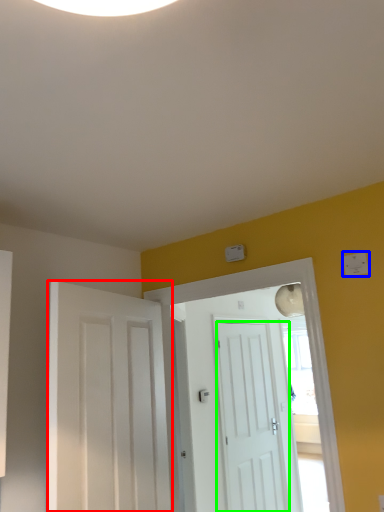
Question: Which object is positioned closest to door (highlighted by a red box)? Select from light switch (highlighted by a blue box) and door (highlighted by a green box).

Choices:
 (A) light switch
 (B) door

Answer: (A)